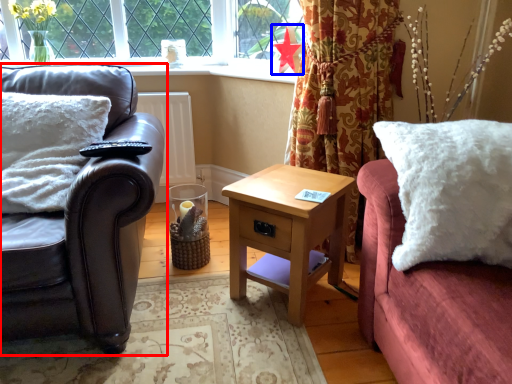
Question: Which object is closer to the camera taking this photo, studio couch (highlighted by a red box) or flower (highlighted by a blue box)?

Choices:
 (A) studio couch
 (B) flower

Answer: (A)